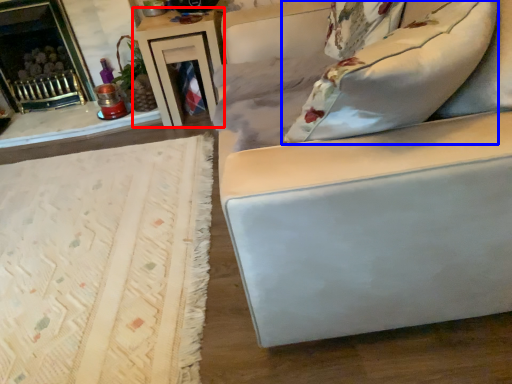
Question: Among these objects, which one is nearest to the camera, table (highlighted by a red box) or pillow (highlighted by a blue box)?

Choices:
 (A) table
 (B) pillow

Answer: (B)